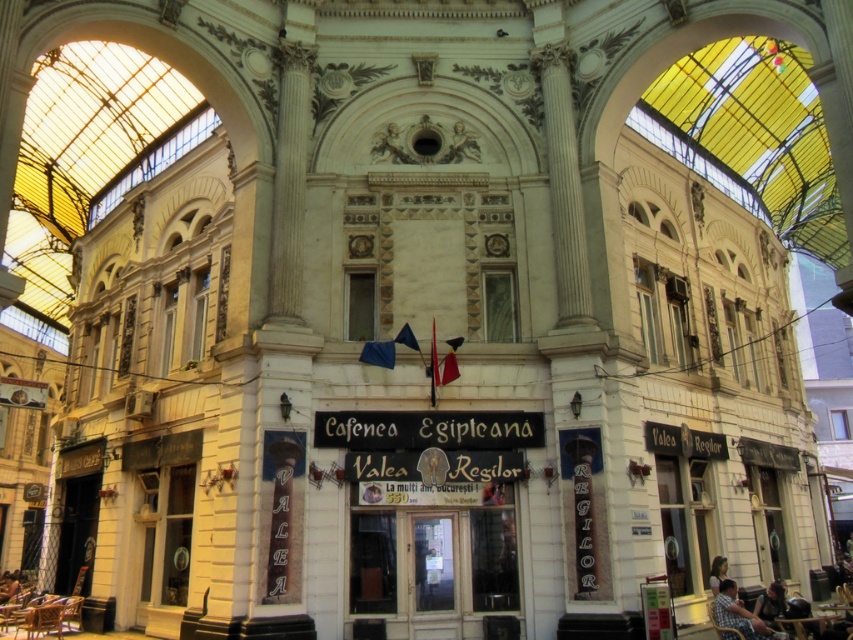
You are a photographer trying to capture a shot of the ornate building. You notice a person with blonde hair at lower right and a dark brown leather chair at lower left in your frame. Which object takes up more space in the photo?

The dark brown leather chair at lower left takes up more space in the photo because the blonde hair at lower right occupies less space than the dark brown leather chair at lower left.

You are a photographer trying to capture both the plaid shirt at lower right and the dark blue fabric shirt at lower right in a single shot. Which shirt should you focus on first to ensure both are in frame?

The plaid shirt at lower right is larger in size than the dark blue fabric shirt at lower right, so you should focus on the plaid shirt at lower right first to ensure both are in frame.